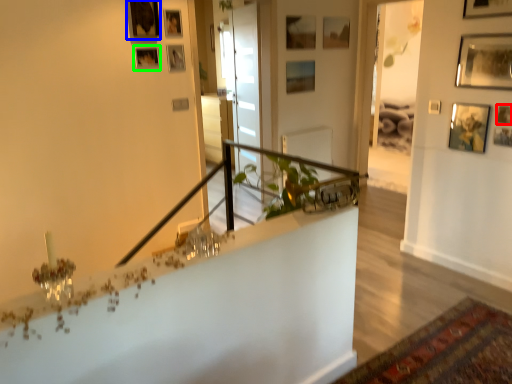
Question: Which is farther away from picture frame (highlighted by a red box)? picture frame (highlighted by a blue box) or picture frame (highlighted by a green box)?

Choices:
 (A) picture frame
 (B) picture frame

Answer: (A)